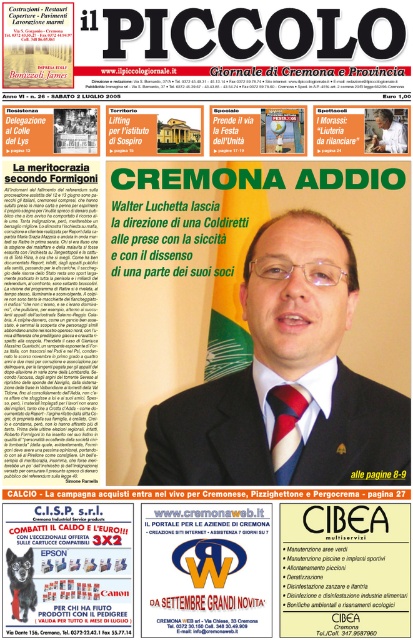
Which is in front, point (197, 460) or point (401, 141)?

Point (197, 460) is in front.

Find the location of `matte green tie at center`. matte green tie at center is located at coordinates (287, 381).

Can you confirm if matte green tie at center is bigger than red silk tie at center?

Yes, matte green tie at center is bigger than red silk tie at center.

Describe the element at coordinates (287, 381) in the screenshot. The width and height of the screenshot is (413, 640). I see `matte green tie at center` at that location.

The width and height of the screenshot is (413, 640). In order to click on matte green tie at center in this screenshot , I will do `click(287, 381)`.

Does matte green tie at center have a smaller size compared to matte black suit at center?

No.

Which is more to the left, matte green tie at center or matte black suit at center?

Positioned to the left is matte black suit at center.

Which is in front, point (303, 340) or point (372, 401)?

Point (303, 340)

Image resolution: width=413 pixels, height=640 pixels. I want to click on matte green tie at center, so click(x=287, y=381).